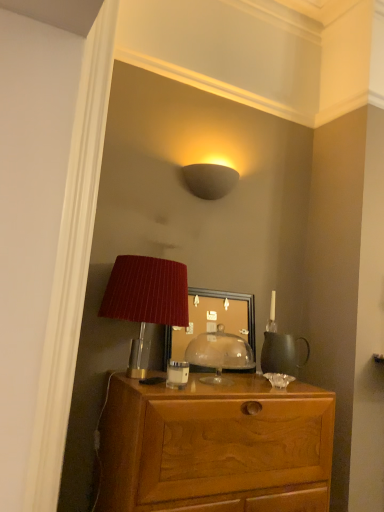
Question: Is matte red lampshade at center beside white glossy coffee cup at center?

Choices:
 (A) yes
 (B) no

Answer: (B)

Question: Is matte red lampshade at center shorter than white glossy coffee cup at center?

Choices:
 (A) yes
 (B) no

Answer: (B)

Question: From a real-world perspective, is matte red lampshade at center located beneath white glossy coffee cup at center?

Choices:
 (A) yes
 (B) no

Answer: (B)

Question: Does matte red lampshade at center have a larger size compared to white glossy coffee cup at center?

Choices:
 (A) yes
 (B) no

Answer: (A)

Question: Is matte red lampshade at center closer to camera compared to white glossy coffee cup at center?

Choices:
 (A) no
 (B) yes

Answer: (A)

Question: In terms of height, does wooden desk at center look taller or shorter compared to matte gray wall sconce at upper center, the first lamp from the top?

Choices:
 (A) tall
 (B) short

Answer: (A)

Question: Would you say wooden desk at center is inside or outside matte gray wall sconce at upper center, the 2th lamp in the bottom-to-top sequence?

Choices:
 (A) inside
 (B) outside

Answer: (B)

Question: Considering the positions of wooden desk at center and matte gray wall sconce at upper center, the first lamp in the back-to-front sequence, in the image, is wooden desk at center wider or thinner than matte gray wall sconce at upper center, the first lamp in the back-to-front sequence,?

Choices:
 (A) wide
 (B) thin

Answer: (A)

Question: From the image's perspective, relative to matte gray wall sconce at upper center, positioned as the 2th lamp in front-to-back order, is wooden desk at center above or below?

Choices:
 (A) above
 (B) below

Answer: (B)

Question: Considering the positions of matte glass mirror at center and matte red lampshade at center in the image, is matte glass mirror at center bigger or smaller than matte red lampshade at center?

Choices:
 (A) big
 (B) small

Answer: (A)

Question: Considering the positions of matte glass mirror at center and matte red lampshade at center in the image, is matte glass mirror at center wider or thinner than matte red lampshade at center?

Choices:
 (A) thin
 (B) wide

Answer: (A)

Question: Choose the correct answer: Is matte glass mirror at center inside matte red lampshade at center or outside it?

Choices:
 (A) inside
 (B) outside

Answer: (B)

Question: Is point (163, 351) closer or farther from the camera than point (235, 366)?

Choices:
 (A) closer
 (B) farther

Answer: (A)

Question: Would you say matte red lampshade at center is to the left or to the right of matte glass mirror at center in the picture?

Choices:
 (A) right
 (B) left

Answer: (A)

Question: Is matte red lampshade at center in front of or behind matte glass mirror at center in the image?

Choices:
 (A) front
 (B) behind

Answer: (A)